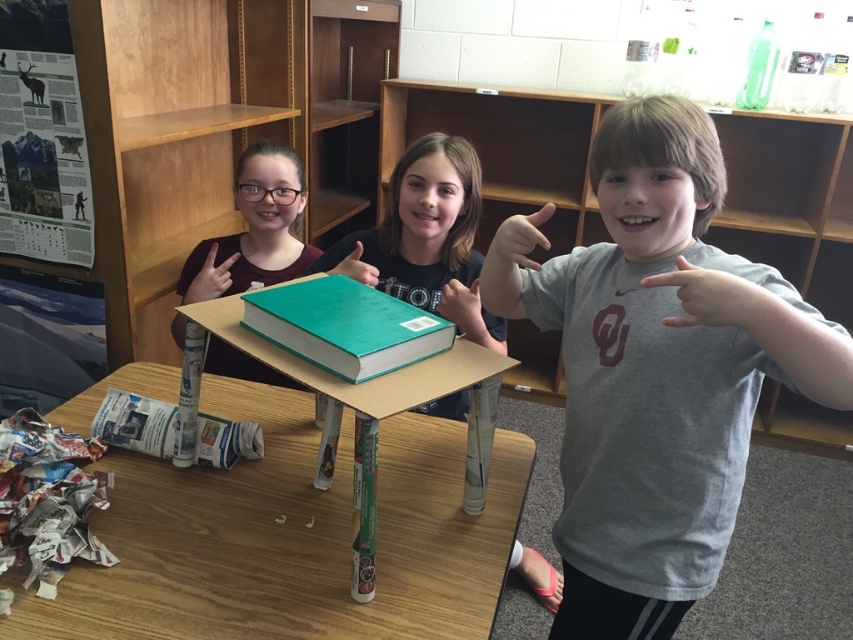
From the picture: You are a student who needs to reach the white cardboard book at lower left. The book is on a shelf that is 4 feet tall. Can you determine if the book is within your reach?

The white cardboard book at lower left is 4.39 feet from the camera, so it is slightly higher than the 4 feet shelf. You might need to stand on something to reach it.

You are a teacher organizing a classroom activity. You have a white cardboard book at lower left and a matte gray finger at upper right. Which object is smaller?

The white cardboard book at lower left is smaller than the matte gray finger at upper right according to the description.